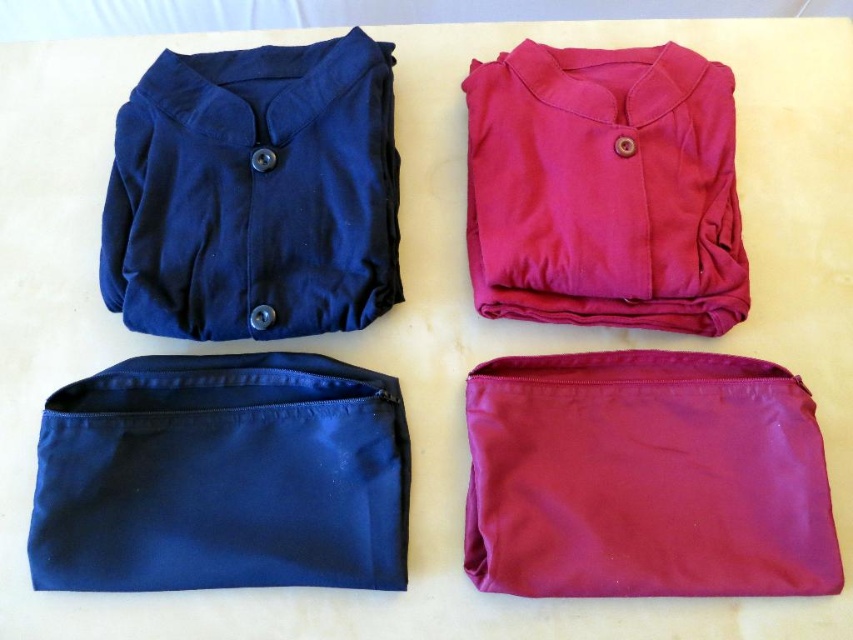
Question: In this image, where is matte purple pouch at bottom right located relative to matte pink fabric shirt at upper right?

Choices:
 (A) right
 (B) left

Answer: (A)

Question: Which of the following is the closest to the observer?

Choices:
 (A) (294, 120)
 (B) (486, 504)
 (C) (695, 280)

Answer: (B)

Question: Which object appears closest to the camera in this image?

Choices:
 (A) matte purple pouch at bottom right
 (B) matte blue fabric shirt at upper left

Answer: (A)

Question: Can you confirm if matte purple pouch at bottom right is positioned above matte blue fabric shirt at upper left?

Choices:
 (A) no
 (B) yes

Answer: (A)

Question: Which object is closer to the camera taking this photo?

Choices:
 (A) matte blue fabric shirt at upper left
 (B) matte purple pouch at bottom right
 (C) navy blue fabric pouch at lower left
 (D) matte pink fabric shirt at upper right

Answer: (B)

Question: Observing the image, what is the correct spatial positioning of matte blue fabric shirt at upper left in reference to matte pink fabric shirt at upper right?

Choices:
 (A) below
 (B) above

Answer: (A)